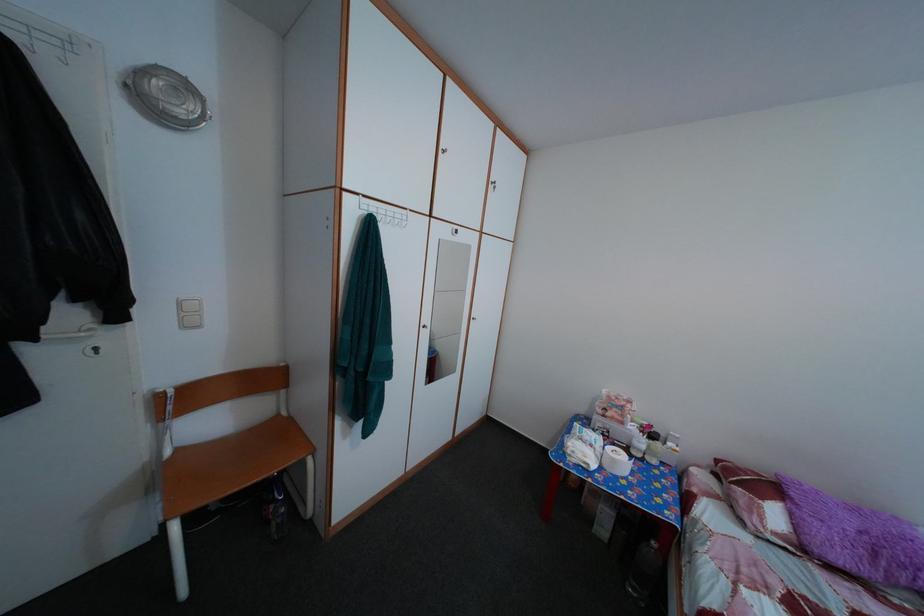
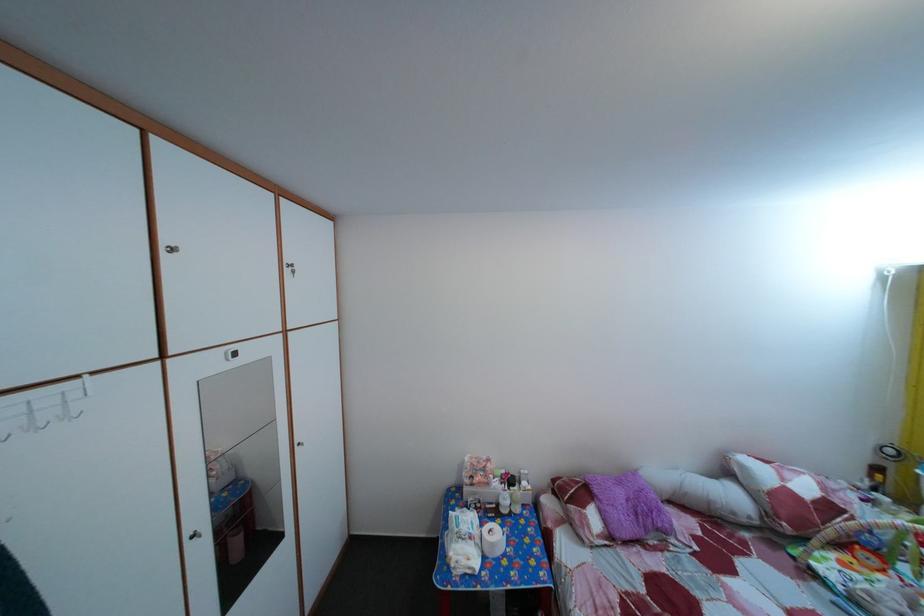
Where in the second image is the point corresponding to [623,468] from the first image?

(502, 553)